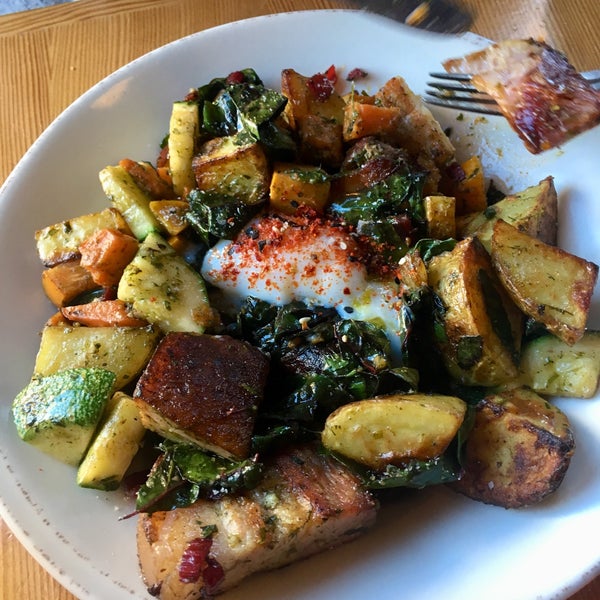
I want to click on table, so click(27, 571), click(62, 49), click(576, 21).